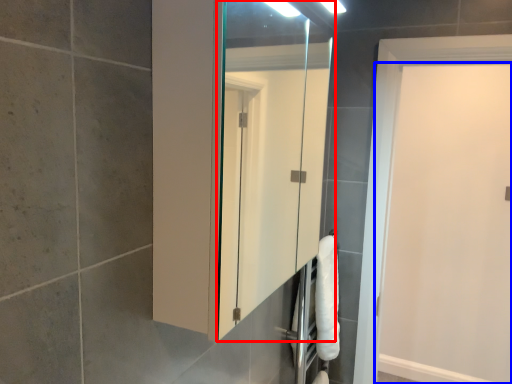
Question: Which object appears farthest to the camera in this image, mirror (highlighted by a red box) or door (highlighted by a blue box)?

Choices:
 (A) mirror
 (B) door

Answer: (B)